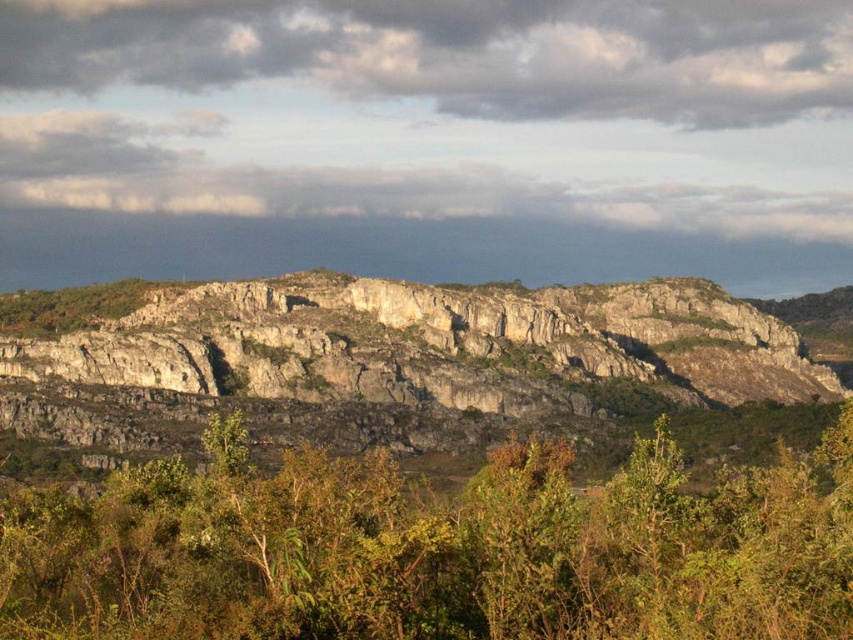
Which is behind, point (42, 408) or point (20, 42)?

The point (20, 42) is behind.

Which of these two, gray rock formation at center or cloudy sky at upper center, stands shorter?

gray rock formation at center is shorter.

Image resolution: width=853 pixels, height=640 pixels. I want to click on gray rock formation at center, so click(x=380, y=358).

Measure the distance between green leafy shrub at center and cloudy sky at upper center.

green leafy shrub at center and cloudy sky at upper center are 333.68 meters apart.

Between green leafy shrub at center and cloudy sky at upper center, which one appears on the right side from the viewer's perspective?

green leafy shrub at center is more to the right.

Describe the element at coordinates (437, 550) in the screenshot. I see `green leafy shrub at center` at that location.

At what (x,y) coordinates should I click in order to perform the action: click on green leafy shrub at center. Please return your answer as a coordinate pair (x, y). The image size is (853, 640). Looking at the image, I should click on (437, 550).

Which is below, green leafy shrub at center or gray rock formation at center?

Positioned lower is green leafy shrub at center.

Is green leafy shrub at center behind gray rock formation at center?

No, green leafy shrub at center is in front of gray rock formation at center.

Find the location of a particular element. green leafy shrub at center is located at coordinates (437, 550).